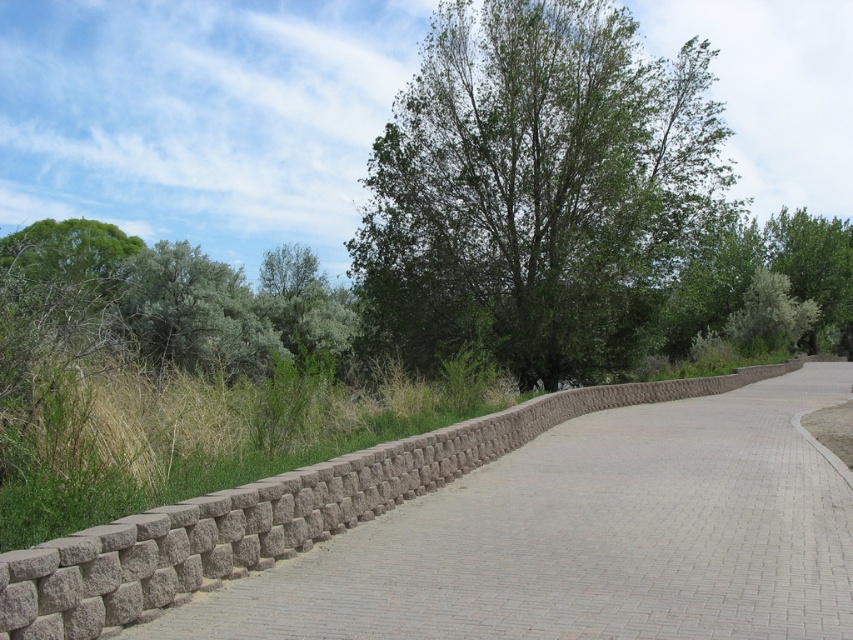
Question: Does green leafy shrub at left have a smaller size compared to green leafy tree at upper right?

Choices:
 (A) no
 (B) yes

Answer: (A)

Question: Estimate the real-world distances between objects in this image. Which object is farther from the green leafy shrub at left?

Choices:
 (A) brown brick pavement at center
 (B) green leafy tree at center

Answer: (A)

Question: Where is green leafy tree at center located in relation to green leafy tree at upper right in the image?

Choices:
 (A) left
 (B) right

Answer: (A)

Question: Can you confirm if brown brick pavement at center is thinner than green leafy tree at center?

Choices:
 (A) no
 (B) yes

Answer: (B)

Question: Which point is farther to the camera?

Choices:
 (A) (485, 512)
 (B) (294, 278)
 (C) (613, 150)
 (D) (817, 227)

Answer: (D)

Question: Which point appears closest to the camera in this image?

Choices:
 (A) (821, 291)
 (B) (100, 291)
 (C) (509, 28)
 (D) (482, 586)

Answer: (D)